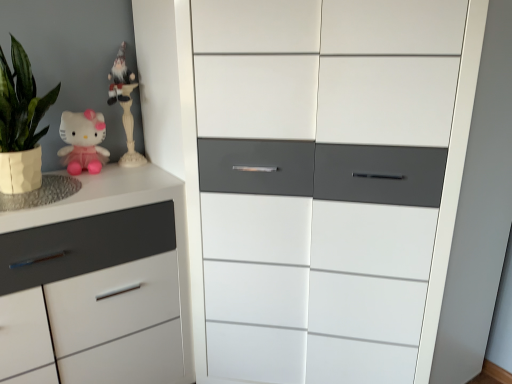
Question: Considering the relative sizes of white glossy cabinet at center, the 1th chest of drawers viewed from the right, and matte pink plush at upper left in the image provided, is white glossy cabinet at center, the 1th chest of drawers viewed from the right, thinner than matte pink plush at upper left?

Choices:
 (A) no
 (B) yes

Answer: (A)

Question: Could you tell me if white glossy cabinet at center, the 1th chest of drawers viewed from the right, is facing matte pink plush at upper left?

Choices:
 (A) no
 (B) yes

Answer: (A)

Question: Is white glossy cabinet at center, the 1th chest of drawers viewed from the right, shorter than matte pink plush at upper left?

Choices:
 (A) yes
 (B) no

Answer: (B)

Question: From the image's perspective, would you say white glossy cabinet at center, the 1th chest of drawers viewed from the right, is shown under matte pink plush at upper left?

Choices:
 (A) no
 (B) yes

Answer: (B)

Question: Considering the relative sizes of white glossy cabinet at center, the 1th chest of drawers viewed from the right, and matte pink plush at upper left in the image provided, is white glossy cabinet at center, the 1th chest of drawers viewed from the right, smaller than matte pink plush at upper left?

Choices:
 (A) yes
 (B) no

Answer: (B)

Question: Looking at the image, does white glossy gnome at upper left seem bigger or smaller compared to matte pink plush at upper left?

Choices:
 (A) small
 (B) big

Answer: (B)

Question: Is white glossy gnome at upper left wider or thinner than matte pink plush at upper left?

Choices:
 (A) thin
 (B) wide

Answer: (B)

Question: Is white glossy gnome at upper left inside the boundaries of matte pink plush at upper left, or outside?

Choices:
 (A) inside
 (B) outside

Answer: (B)

Question: Considering the relative positions of white glossy gnome at upper left and matte pink plush at upper left in the image provided, is white glossy gnome at upper left to the left or to the right of matte pink plush at upper left?

Choices:
 (A) right
 (B) left

Answer: (A)

Question: In the image, is white glossy cabinet at center, positioned as the second chest of drawers in left-to-right order, on the left side or the right side of white matte chest of drawers at left, the second chest of drawers positioned from the right?

Choices:
 (A) right
 (B) left

Answer: (A)

Question: Is point (452, 6) positioned closer to the camera than point (72, 249)?

Choices:
 (A) farther
 (B) closer

Answer: (B)

Question: In terms of size, does white glossy cabinet at center, the 1th chest of drawers viewed from the right, appear bigger or smaller than white matte chest of drawers at left, which ranks as the first chest of drawers in left-to-right order?

Choices:
 (A) big
 (B) small

Answer: (A)

Question: Considering the positions of white glossy cabinet at center, the 1th chest of drawers viewed from the right, and white matte chest of drawers at left, which ranks as the first chest of drawers in left-to-right order, in the image, is white glossy cabinet at center, the 1th chest of drawers viewed from the right, taller or shorter than white matte chest of drawers at left, which ranks as the first chest of drawers in left-to-right order,?

Choices:
 (A) short
 (B) tall

Answer: (B)

Question: Is white matte chest of drawers at left, which ranks as the first chest of drawers in left-to-right order, spatially inside white glossy cabinet at center, the 1th chest of drawers viewed from the right, or outside of it?

Choices:
 (A) outside
 (B) inside

Answer: (A)

Question: Is white matte chest of drawers at left, which ranks as the first chest of drawers in left-to-right order, taller or shorter than white glossy cabinet at center, the 1th chest of drawers viewed from the right?

Choices:
 (A) short
 (B) tall

Answer: (A)